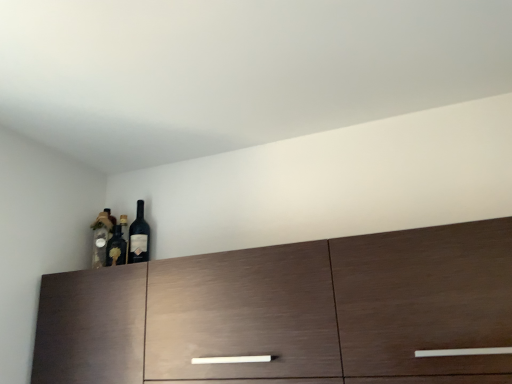
Question: Is dark wood cabinet at center to the left or to the right of matte glass wine bottle at upper left in the image?

Choices:
 (A) left
 (B) right

Answer: (B)

Question: Based on their sizes in the image, would you say dark wood cabinet at center is bigger or smaller than matte glass wine bottle at upper left?

Choices:
 (A) small
 (B) big

Answer: (B)

Question: Which is nearer to the dark wood cabinet at center?

Choices:
 (A) matte glass wine bottle at upper left
 (B) matte glass bottle at left

Answer: (A)

Question: Which object is positioned farthest from the matte glass bottle at left?

Choices:
 (A) dark wood cabinet at center
 (B) matte glass wine bottle at upper left

Answer: (A)